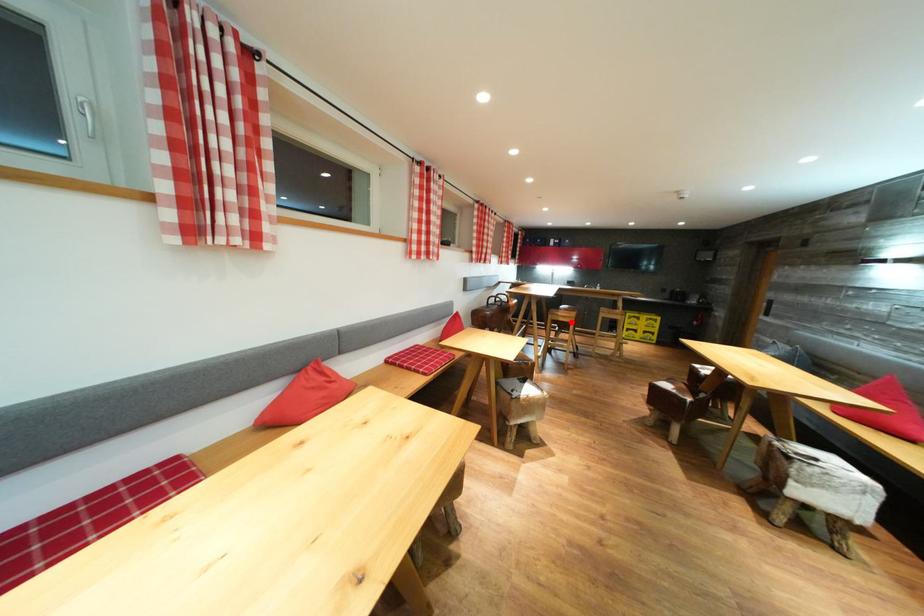
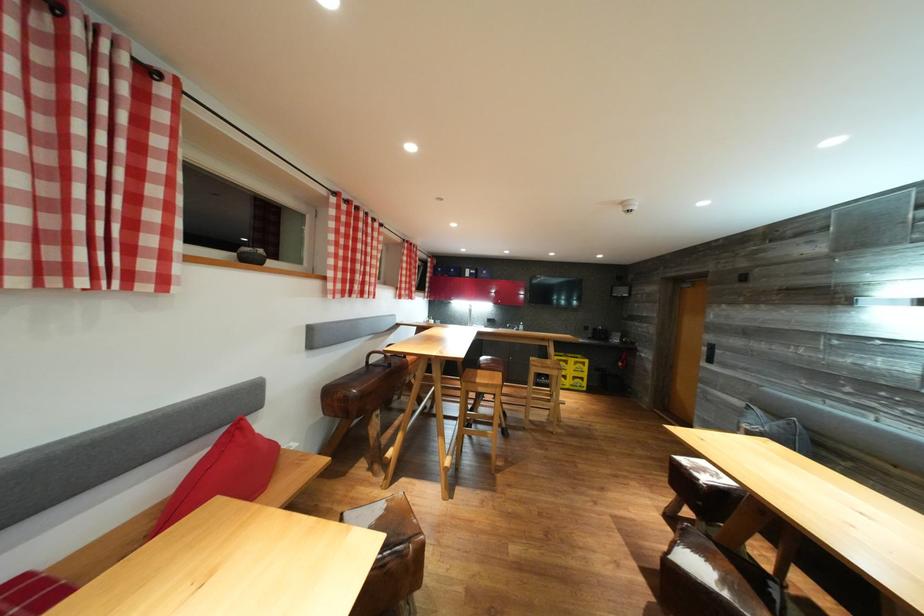
Question: I am providing you with two images of the same scene from different viewpoints. Image1 has a red point marked. In image2, the corresponding 3D location appears at what relative position? Reply with the corresponding letter.

Choices:
 (A) Closer
 (B) Farther

Answer: (B)